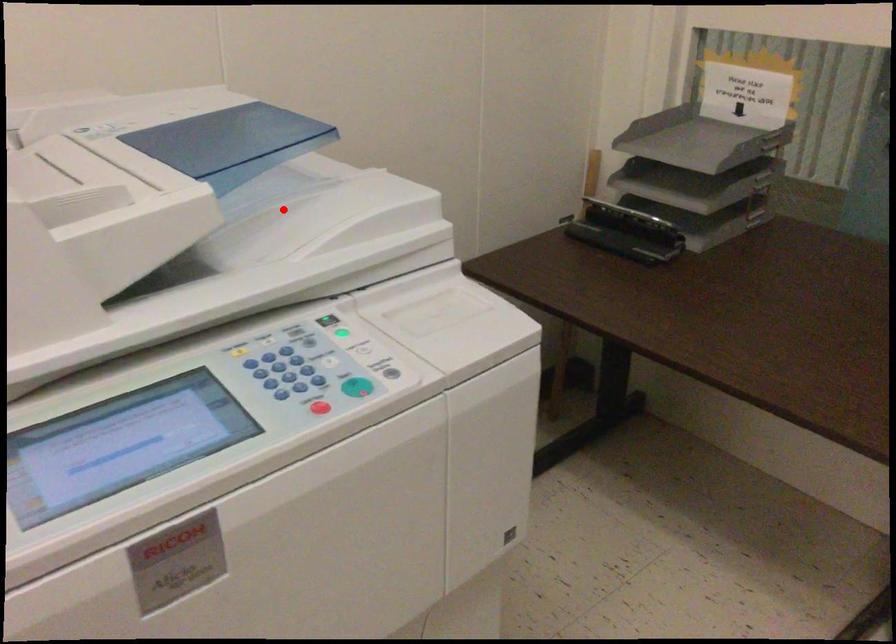
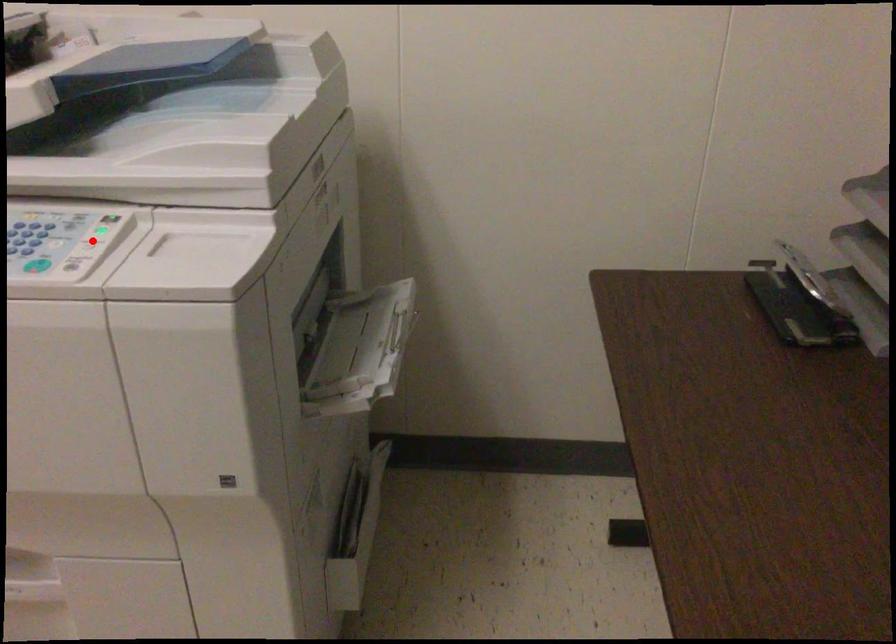
I am providing you with two images of the same scene from different viewpoints. A red point is marked on the first image and another point is marked on the second image. Are the points marked in image1 and image2 representing the same 3D position?

No